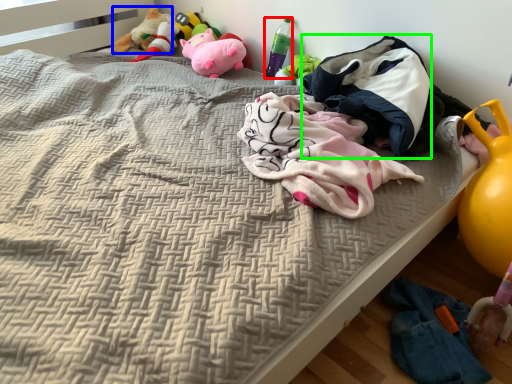
Question: Estimate the real-world distances between objects in this image. Which object is closer to bottle (highlighted by a red box), toy (highlighted by a blue box) or baby clothe (highlighted by a green box)?

Choices:
 (A) toy
 (B) baby clothe

Answer: (B)